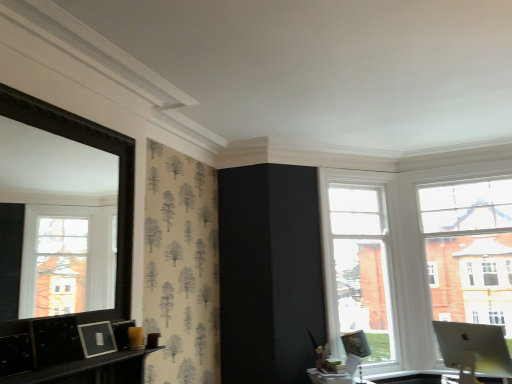
Question: Is clear glass window at center, the second window viewed from the right, a part of metallic silver swivel chair at right?

Choices:
 (A) no
 (B) yes

Answer: (A)

Question: From a real-world perspective, is metallic silver swivel chair at right on clear glass window at center, the second window viewed from the right?

Choices:
 (A) no
 (B) yes

Answer: (A)

Question: Is metallic silver swivel chair at right positioned in front of clear glass window at center, which is counted as the first window, starting from the left?

Choices:
 (A) yes
 (B) no

Answer: (A)

Question: Can you confirm if metallic silver swivel chair at right is positioned to the left of clear glass window at center, which is counted as the first window, starting from the left?

Choices:
 (A) no
 (B) yes

Answer: (B)

Question: Considering the relative sizes of metallic silver swivel chair at right and clear glass window at center, which is counted as the first window, starting from the left, in the image provided, is metallic silver swivel chair at right wider than clear glass window at center, which is counted as the first window, starting from the left,?

Choices:
 (A) no
 (B) yes

Answer: (A)

Question: In terms of height, does silver metallic monitor at lower right look taller or shorter compared to metallic silver swivel chair at right?

Choices:
 (A) short
 (B) tall

Answer: (A)

Question: From the image's perspective, is silver metallic monitor at lower right positioned above or below metallic silver swivel chair at right?

Choices:
 (A) below
 (B) above

Answer: (B)

Question: In terms of width, does silver metallic monitor at lower right look wider or thinner when compared to metallic silver swivel chair at right?

Choices:
 (A) thin
 (B) wide

Answer: (B)

Question: Is point (470, 327) closer or farther from the camera than point (359, 370)?

Choices:
 (A) closer
 (B) farther

Answer: (A)

Question: In the image, is clear glass window at center, which is counted as the first window, starting from the left, on the left side or the right side of silver metallic monitor at lower right?

Choices:
 (A) left
 (B) right

Answer: (A)

Question: Considering the positions of clear glass window at center, the second window viewed from the right, and silver metallic monitor at lower right in the image, is clear glass window at center, the second window viewed from the right, taller or shorter than silver metallic monitor at lower right?

Choices:
 (A) short
 (B) tall

Answer: (B)

Question: In terms of width, does clear glass window at center, which is counted as the first window, starting from the left, look wider or thinner when compared to silver metallic monitor at lower right?

Choices:
 (A) wide
 (B) thin

Answer: (A)

Question: Considering their positions, is clear glass window at center, which is counted as the first window, starting from the left, located in front of or behind silver metallic monitor at lower right?

Choices:
 (A) front
 (B) behind

Answer: (B)

Question: Considering the positions of clear glass window at center, the second window viewed from the right, and metallic silver swivel chair at right in the image, is clear glass window at center, the second window viewed from the right, bigger or smaller than metallic silver swivel chair at right?

Choices:
 (A) small
 (B) big

Answer: (B)

Question: Considering the relative positions of clear glass window at center, the second window viewed from the right, and metallic silver swivel chair at right in the image provided, is clear glass window at center, the second window viewed from the right, to the left or to the right of metallic silver swivel chair at right?

Choices:
 (A) right
 (B) left

Answer: (A)